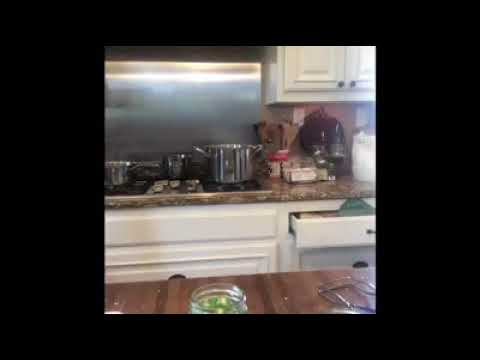
Identify the location of cupboard. (365, 67).